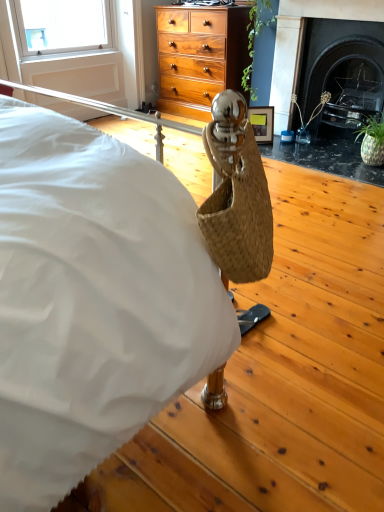
Question: Relative to wooden picture frame at center, is black marble fireplace at upper right in front or behind?

Choices:
 (A) front
 (B) behind

Answer: (A)

Question: Looking at the image, does black marble fireplace at upper right seem bigger or smaller compared to wooden picture frame at center?

Choices:
 (A) big
 (B) small

Answer: (A)

Question: Estimate the real-world distances between objects in this image. Which object is closer to the black marble fireplace at upper right?

Choices:
 (A) wooden picture frame at center
 (B) clear glass vase at right, the 1th plant when ordered from right to left
 (C) green leafy plant at upper center, the second plant positioned from the right

Answer: (B)

Question: Which of these objects is positioned closest to the clear glass vase at right, the 1th plant when ordered from right to left?

Choices:
 (A) wooden picture frame at center
 (B) black marble fireplace at upper right
 (C) green leafy plant at upper center, the 2th plant from the bottom

Answer: (B)